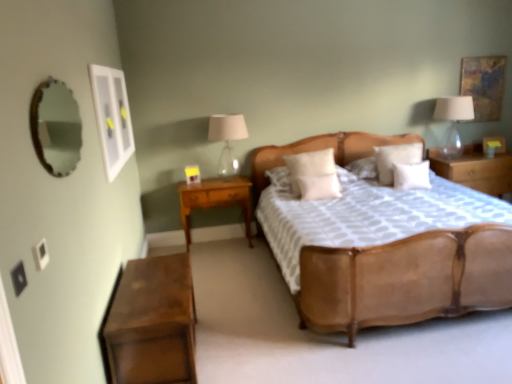
The width and height of the screenshot is (512, 384). Identify the location of free space to the back side of wooden nightstand at lower left, placed as the 3th nightstand when sorted from back to front. (223, 301).